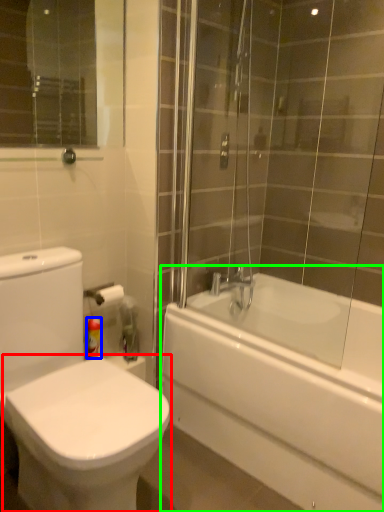
Question: Which object is the closest to the bidet (highlighted by a red box)? Choose among these: toiletry (highlighted by a blue box) or bathtub (highlighted by a green box).

Choices:
 (A) toiletry
 (B) bathtub

Answer: (A)